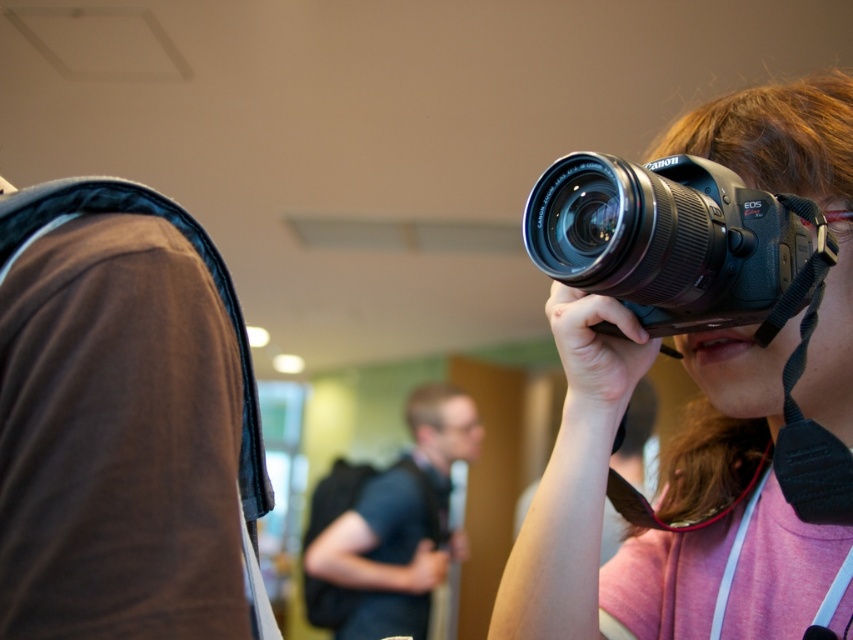
You are at a social event and need to take a photo. You see a black plastic camera at upper right and a black matte shirt at center. Which object is located more to the right side of the image?

The black plastic camera at upper right is located more to the right side of the image compared to the black matte shirt at center.

You are at an event and need to take a photo of the person wearing the black matte shirt at center. The matte black camera at upper right is available. Can you use this camera to capture the subject without moving your position?

The matte black camera at upper right is positioned on the right side of the black matte shirt at center. Since the camera is to the right of the subject, you can aim the camera towards the left to capture the person wearing the black matte shirt at center without moving your position.